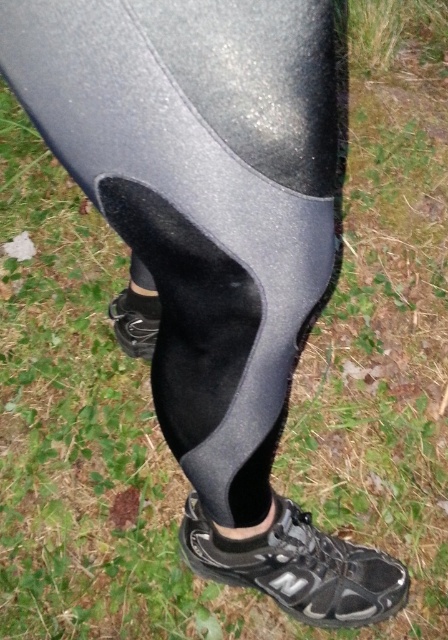
Looking at this image, does black mesh shoe at lower center have a larger size compared to black felt sock at lower center?

Yes, black mesh shoe at lower center is bigger than black felt sock at lower center.

At what (x,y) coordinates should I click in order to perform the action: click on black mesh shoe at lower center. Please return your answer as a coordinate pair (x, y). Looking at the image, I should click on (297, 566).

Describe the element at coordinates (297, 566) in the screenshot. I see `black mesh shoe at lower center` at that location.

At what (x,y) coordinates should I click in order to perform the action: click on black mesh shoe at lower center. Please return your answer as a coordinate pair (x, y). This screenshot has width=448, height=640. Looking at the image, I should click on (297, 566).

Is black mesh shoe at lower center closer to camera compared to matte black shoe at lower center?

Yes, black mesh shoe at lower center is closer to the viewer.

Looking at this image, can you confirm if black mesh shoe at lower center is bigger than matte black shoe at lower center?

Indeed, black mesh shoe at lower center has a larger size compared to matte black shoe at lower center.

Which is behind, point (192, 502) or point (115, 310)?

The point (115, 310) is more distant.

Find the location of `black mesh shoe at lower center`. black mesh shoe at lower center is located at coordinates (297, 566).

Is point (138, 298) behind point (150, 312)?

That is False.

Can you confirm if matte black shoe at lower center is wider than black felt sock at lower center?

Indeed, matte black shoe at lower center has a greater width compared to black felt sock at lower center.

The width and height of the screenshot is (448, 640). In order to click on matte black shoe at lower center in this screenshot , I will do `click(136, 321)`.

Locate an element on the screen. The image size is (448, 640). matte black shoe at lower center is located at coordinates (136, 321).